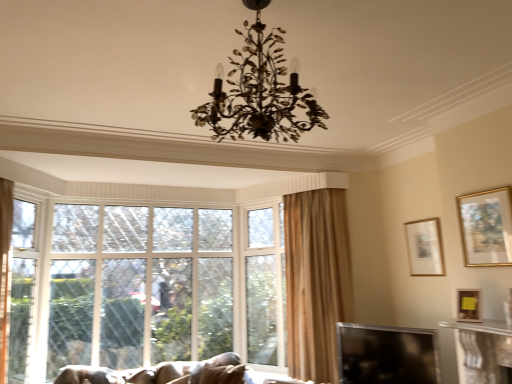
Question: Looking at the image, does transparent glass window screen at lower right seem bigger or smaller compared to gold metallic chandelier at center?

Choices:
 (A) big
 (B) small

Answer: (B)

Question: From the image's perspective, is transparent glass window screen at lower right positioned above or below gold metallic chandelier at center?

Choices:
 (A) below
 (B) above

Answer: (A)

Question: Considering the real-world distances, which object is closest to the gold metallic chandelier at center?

Choices:
 (A) clear glass screen door at left
 (B) wooden picture frame at lower right, marked as the 2th picture frame in a back-to-front arrangement
 (C) clear glass window at center
 (D) transparent glass window screen at lower right
 (E) velvet brown sofa at lower left

Answer: (B)

Question: Estimate the real-world distances between objects in this image. Which object is closer to the clear glass window at center?

Choices:
 (A) gold metallic chandelier at center
 (B) velvet brown sofa at lower left
 (C) wooden picture frame at lower right, marked as the 2th picture frame in a back-to-front arrangement
 (D) gold-framed painting at upper right, which ranks as the first picture frame in front-to-back order
 (E) transparent glass window screen at lower right

Answer: (B)